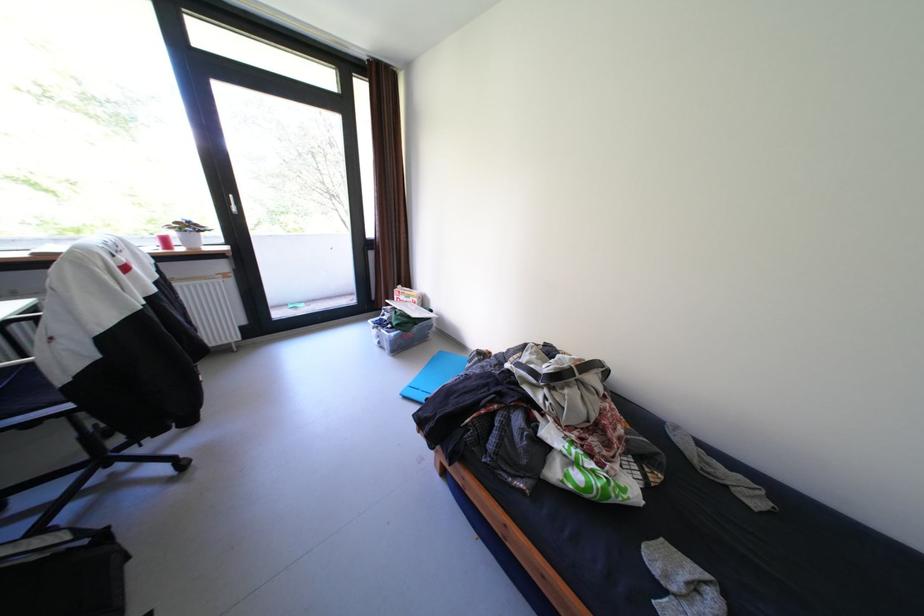
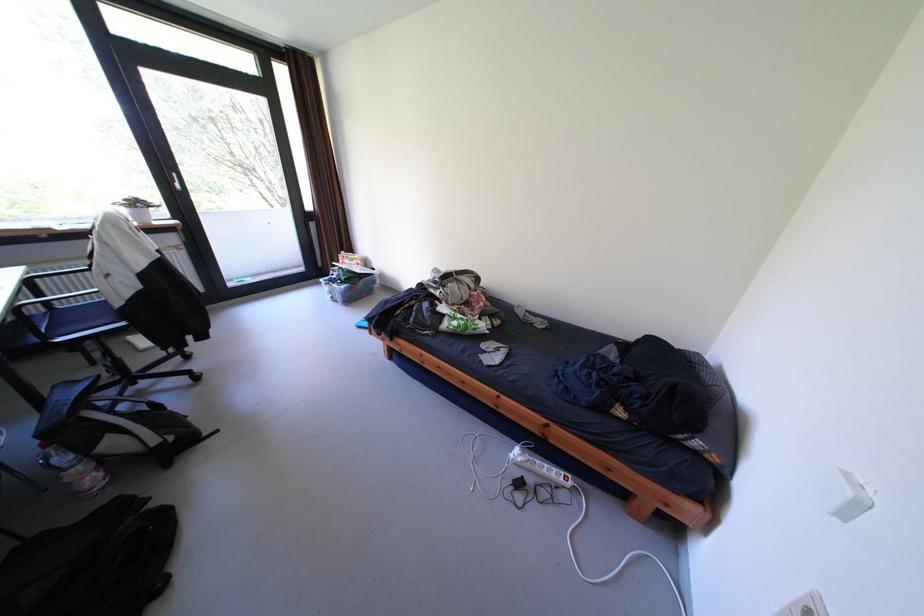
Locate, in the second image, the point that corresponds to [407,320] in the first image.

(355, 275)